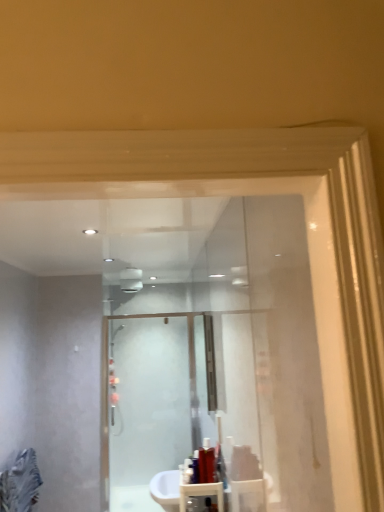
Question: Considering the positions of translucent plastic bottle at center, marked as the first toiletry in a right-to-left arrangement, and frosted glass shower door at center in the image, is translucent plastic bottle at center, marked as the first toiletry in a right-to-left arrangement, wider or thinner than frosted glass shower door at center?

Choices:
 (A) wide
 (B) thin

Answer: (A)

Question: Is point (211, 463) positioned closer to the camera than point (125, 355)?

Choices:
 (A) closer
 (B) farther

Answer: (A)

Question: Which of these objects is positioned farthest from the white glossy bath at lower center?

Choices:
 (A) shiny red bottle at lower center, marked as the first toiletry in a front-to-back arrangement
 (B) translucent plastic bottle at center, which appears as the first toiletry when viewed from the back
 (C) shiny red bottle at lower center, which is counted as the third toiletry, starting from the right
 (D) frosted glass shower door at center

Answer: (D)

Question: Which object is positioned farthest from the shiny red bottle at lower center, which is the 2th toiletry in front-to-back order?

Choices:
 (A) white glossy bath at lower center
 (B) shiny red bottle at lower center, which appears as the second toiletry when viewed from the left
 (C) translucent plastic bottle at center, which is the third toiletry from left to right
 (D) frosted glass shower door at center

Answer: (D)